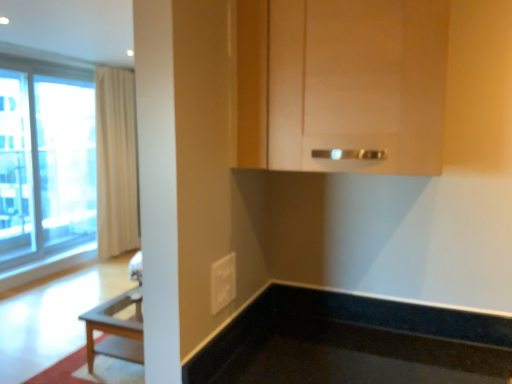
Question: Could you tell me if white plastic electric outlet at lower center is turned towards matte wood cabinet at upper center?

Choices:
 (A) yes
 (B) no

Answer: (B)

Question: Is white plastic electric outlet at lower center wider than matte wood cabinet at upper center?

Choices:
 (A) no
 (B) yes

Answer: (A)

Question: From the image's perspective, is white plastic electric outlet at lower center over matte wood cabinet at upper center?

Choices:
 (A) yes
 (B) no

Answer: (B)

Question: Is white plastic electric outlet at lower center closer to camera compared to matte wood cabinet at upper center?

Choices:
 (A) yes
 (B) no

Answer: (B)

Question: Is matte wood cabinet at upper center inside white plastic electric outlet at lower center?

Choices:
 (A) yes
 (B) no

Answer: (B)

Question: From the image's perspective, relative to white plastic electric outlet at lower center, is beige fabric curtain at left above or below?

Choices:
 (A) above
 (B) below

Answer: (A)

Question: In terms of height, does beige fabric curtain at left look taller or shorter compared to white plastic electric outlet at lower center?

Choices:
 (A) tall
 (B) short

Answer: (A)

Question: Is beige fabric curtain at left inside or outside of white plastic electric outlet at lower center?

Choices:
 (A) outside
 (B) inside

Answer: (A)

Question: Considering the positions of beige fabric curtain at left and white plastic electric outlet at lower center in the image, is beige fabric curtain at left wider or thinner than white plastic electric outlet at lower center?

Choices:
 (A) wide
 (B) thin

Answer: (A)

Question: From a real-world perspective, is beige fabric curtain at left above or below matte wood cabinet at upper center?

Choices:
 (A) below
 (B) above

Answer: (A)

Question: Considering the positions of point (121, 160) and point (366, 59), is point (121, 160) closer or farther from the camera than point (366, 59)?

Choices:
 (A) closer
 (B) farther

Answer: (B)

Question: Considering the relative positions of beige fabric curtain at left and matte wood cabinet at upper center in the image provided, is beige fabric curtain at left to the left or to the right of matte wood cabinet at upper center?

Choices:
 (A) right
 (B) left

Answer: (B)

Question: From the image's perspective, is beige fabric curtain at left positioned above or below matte wood cabinet at upper center?

Choices:
 (A) above
 (B) below

Answer: (A)

Question: Is transparent glass screen door at left in front of or behind beige fabric curtain at left in the image?

Choices:
 (A) front
 (B) behind

Answer: (A)

Question: Considering the positions of transparent glass screen door at left and beige fabric curtain at left in the image, is transparent glass screen door at left bigger or smaller than beige fabric curtain at left?

Choices:
 (A) small
 (B) big

Answer: (A)